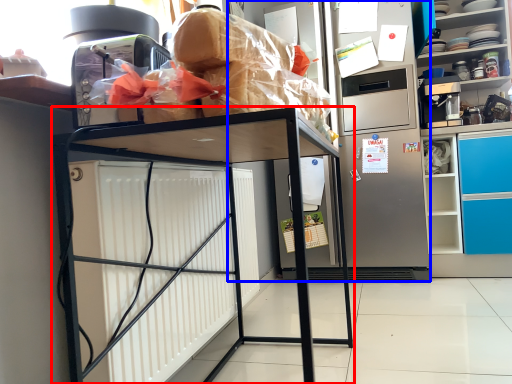
Question: Which of the following is the farthest to the observer, furniture (highlighted by a red box) or appliance (highlighted by a blue box)?

Choices:
 (A) furniture
 (B) appliance

Answer: (B)